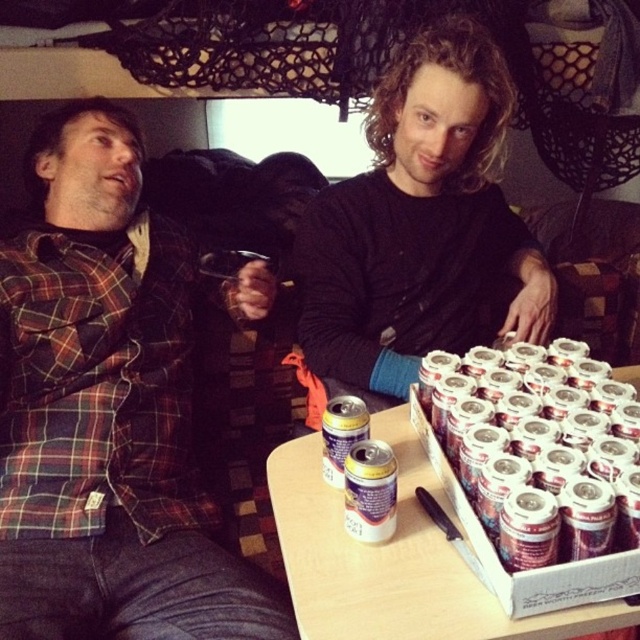
Question: Among these objects, which one is farthest from the camera?

Choices:
 (A) metallic silver table at center
 (B) metallic silver can at center
 (C) plaid fabric shirt at left
 (D) black matte shirt at center

Answer: (D)

Question: Considering the relative positions of plaid fabric shirt at left and metallic silver beer can at center-right in the image provided, where is plaid fabric shirt at left located with respect to metallic silver beer can at center-right?

Choices:
 (A) right
 (B) left

Answer: (B)

Question: From the image, what is the correct spatial relationship of plaid fabric shirt at left in relation to metallic silver can at center?

Choices:
 (A) above
 (B) below

Answer: (A)

Question: Does black matte shirt at center have a larger size compared to yellow metallic can at center?

Choices:
 (A) no
 (B) yes

Answer: (B)

Question: Which point is closer to the camera?

Choices:
 (A) (333, 428)
 (B) (92, 544)

Answer: (A)

Question: Which object is farther from the camera taking this photo?

Choices:
 (A) metallic silver can at center
 (B) metallic silver table at center
 (C) gold foil can at center
 (D) yellow metallic can at center

Answer: (D)